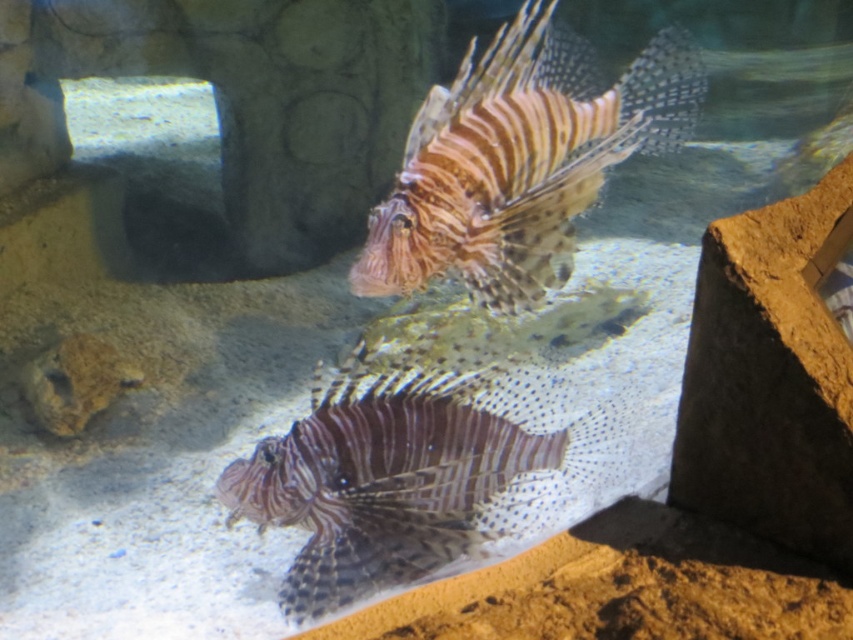
Question: Is spotted purple fish at center positioned in front of brown striped fish at center?

Choices:
 (A) no
 (B) yes

Answer: (A)

Question: Is the position of spotted purple fish at center more distant than that of brown striped fish at center?

Choices:
 (A) no
 (B) yes

Answer: (B)

Question: Which of the following is the farthest from the observer?

Choices:
 (A) spotted purple fish at center
 (B) brown striped fish at center

Answer: (A)

Question: Which object appears farthest from the camera in this image?

Choices:
 (A) brown striped fish at center
 (B) spotted purple fish at center

Answer: (B)

Question: Which of the following is the farthest from the observer?

Choices:
 (A) coord(393,204)
 (B) coord(337,525)

Answer: (B)

Question: In this image, where is spotted purple fish at center located relative to brown striped fish at center?

Choices:
 (A) above
 (B) below

Answer: (B)